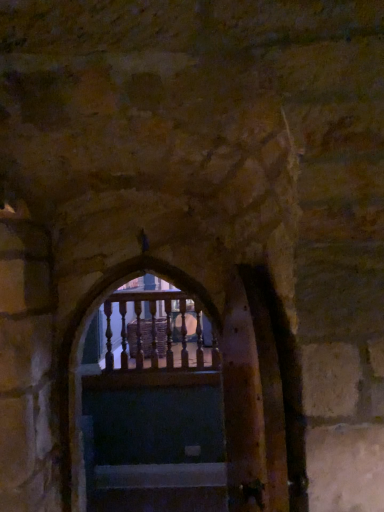
Question: Is wooden balusters at center bigger than wooden stairs at center?

Choices:
 (A) no
 (B) yes

Answer: (B)

Question: From a real-world perspective, does wooden balusters at center sit lower than wooden stairs at center?

Choices:
 (A) no
 (B) yes

Answer: (A)

Question: Is wooden balusters at center turned away from wooden stairs at center?

Choices:
 (A) yes
 (B) no

Answer: (B)

Question: Is wooden stairs at center a part of wooden balusters at center?

Choices:
 (A) no
 (B) yes

Answer: (A)

Question: From a real-world perspective, is wooden balusters at center on wooden stairs at center?

Choices:
 (A) yes
 (B) no

Answer: (A)

Question: Does wooden balusters at center lie in front of wooden stairs at center?

Choices:
 (A) no
 (B) yes

Answer: (A)

Question: From a real-world perspective, does wooden stairs at center sit lower than wooden balusters at center?

Choices:
 (A) no
 (B) yes

Answer: (B)

Question: Can you confirm if wooden stairs at center is smaller than wooden balusters at center?

Choices:
 (A) yes
 (B) no

Answer: (A)

Question: Is wooden stairs at center closer to camera compared to wooden balusters at center?

Choices:
 (A) yes
 (B) no

Answer: (A)

Question: Is wooden stairs at center further to the viewer compared to wooden balusters at center?

Choices:
 (A) yes
 (B) no

Answer: (B)

Question: Are wooden stairs at center and wooden balusters at center located far from each other?

Choices:
 (A) yes
 (B) no

Answer: (A)

Question: Can you confirm if wooden stairs at center is positioned to the right of wooden balusters at center?

Choices:
 (A) yes
 (B) no

Answer: (A)

Question: From a real-world perspective, is wooden balusters at center physically located above or below wooden stairs at center?

Choices:
 (A) below
 (B) above

Answer: (B)